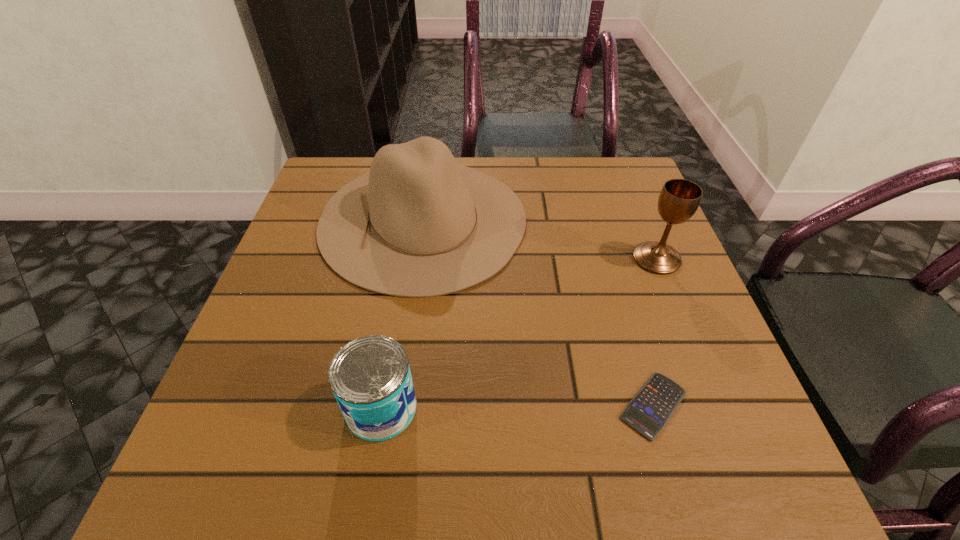
At what (x,y) coordinates should I click in order to perform the action: click on calculator situated at the near edge. Please return your answer as a coordinate pair (x, y). The width and height of the screenshot is (960, 540). Looking at the image, I should click on (651, 408).

Locate an element on the screen. This screenshot has width=960, height=540. object present at the left edge is located at coordinates (418, 224).

The height and width of the screenshot is (540, 960). I want to click on chalice that is at the right edge, so click(x=679, y=199).

You are a GUI agent. You are given a task and a screenshot of the screen. Output one action in this format:
    pyautogui.click(x=<x>, y=<y>)
    Task: Click on the calculator situated at the right edge
    The width and height of the screenshot is (960, 540).
    Given the screenshot: What is the action you would take?
    pyautogui.click(x=651, y=408)

Locate an element on the screen. The height and width of the screenshot is (540, 960). object at the far left corner is located at coordinates (418, 224).

This screenshot has width=960, height=540. In order to click on object that is at the near right corner in this screenshot , I will do `click(651, 408)`.

Image resolution: width=960 pixels, height=540 pixels. Find the location of `vacant space at the left edge`. vacant space at the left edge is located at coordinates (296, 253).

In the image, there is a desktop. At what (x,y) coordinates should I click in order to perform the action: click on blank space at the right edge. Please return your answer as a coordinate pair (x, y). This screenshot has height=540, width=960. Looking at the image, I should click on (636, 215).

Find the location of a particular element. The image size is (960, 540). vacant space at the far right corner is located at coordinates (621, 208).

In the image, there is a desktop. At what (x,y) coordinates should I click in order to perform the action: click on vacant space at the near right corner. Please return your answer as a coordinate pair (x, y). The height and width of the screenshot is (540, 960). Looking at the image, I should click on (703, 459).